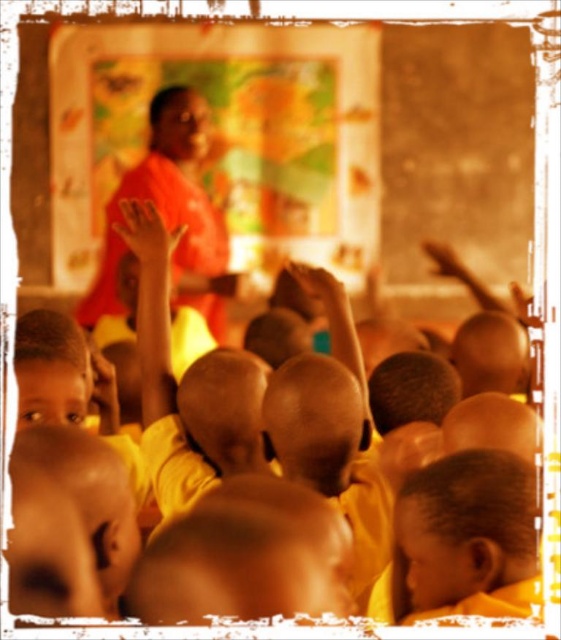
Does yellow matte shirt at center appear on the left side of smooth skin hand at center?

Correct, you'll find yellow matte shirt at center to the left of smooth skin hand at center.

Measure the distance between point (165, 605) and camera.

A distance of 4.77 feet exists between point (165, 605) and camera.

This screenshot has width=561, height=640. What do you see at coordinates (246, 515) in the screenshot?
I see `yellow matte shirt at center` at bounding box center [246, 515].

At what (x,y) coordinates should I click in order to perform the action: click on yellow matte shirt at center. Please return your answer as a coordinate pair (x, y). Looking at the image, I should click on (246, 515).

Does orange matte shirt at upper left have a lesser width compared to matte orange hand at upper left?

In fact, orange matte shirt at upper left might be wider than matte orange hand at upper left.

Who is shorter, orange matte shirt at upper left or matte orange hand at upper left?

Standing shorter between the two is matte orange hand at upper left.

At what (x,y) coordinates should I click in order to perform the action: click on orange matte shirt at upper left. Please return your answer as a coordinate pair (x, y). Looking at the image, I should click on pos(172,212).

Which is below, smooth yellow shirt at lower right or smooth skin hand at center?

Positioned lower is smooth yellow shirt at lower right.

Does smooth yellow shirt at lower right have a lesser width compared to smooth skin hand at center?

No, smooth yellow shirt at lower right is not thinner than smooth skin hand at center.

This screenshot has height=640, width=561. Identify the location of smooth yellow shirt at lower right. (466, 529).

Where is `smooth yellow shirt at lower right`? This screenshot has height=640, width=561. smooth yellow shirt at lower right is located at coordinates (466, 529).